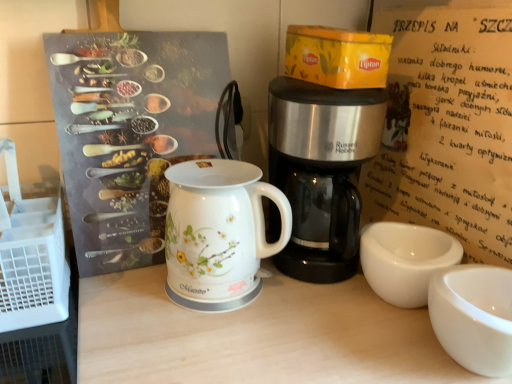
Question: Can you confirm if white glossy cup at lower right is smaller than stainless steel coffee maker at center?

Choices:
 (A) no
 (B) yes

Answer: (B)

Question: Is white glossy cup at lower right not near stainless steel coffee maker at center?

Choices:
 (A) yes
 (B) no

Answer: (B)

Question: Is white glossy cup at lower right positioned in front of stainless steel coffee maker at center?

Choices:
 (A) no
 (B) yes

Answer: (B)

Question: Is stainless steel coffee maker at center located within white glossy cup at lower right?

Choices:
 (A) no
 (B) yes

Answer: (A)

Question: Considering the relative sizes of white glossy cup at lower right and stainless steel coffee maker at center in the image provided, is white glossy cup at lower right wider than stainless steel coffee maker at center?

Choices:
 (A) no
 (B) yes

Answer: (A)

Question: Would you say stainless steel coffee maker at center is inside or outside white glossy cup at lower right?

Choices:
 (A) outside
 (B) inside

Answer: (A)

Question: Does point [x=306, y=130] appear closer or farther from the camera than point [x=473, y=314]?

Choices:
 (A) closer
 (B) farther

Answer: (B)

Question: Considering the positions of stainless steel coffee maker at center and white glossy cup at lower right in the image, is stainless steel coffee maker at center wider or thinner than white glossy cup at lower right?

Choices:
 (A) thin
 (B) wide

Answer: (B)

Question: From their relative heights in the image, would you say stainless steel coffee maker at center is taller or shorter than white glossy cup at lower right?

Choices:
 (A) tall
 (B) short

Answer: (A)

Question: In the image, is white glossy electric kettle at center positioned in front of or behind stainless steel coffee maker at center?

Choices:
 (A) behind
 (B) front

Answer: (A)

Question: From a real-world perspective, relative to stainless steel coffee maker at center, is white glossy electric kettle at center vertically above or below?

Choices:
 (A) above
 (B) below

Answer: (B)

Question: Is white glossy electric kettle at center wider or thinner than stainless steel coffee maker at center?

Choices:
 (A) thin
 (B) wide

Answer: (A)

Question: From the image's perspective, is white glossy electric kettle at center positioned above or below stainless steel coffee maker at center?

Choices:
 (A) below
 (B) above

Answer: (A)

Question: Is white glossy electric kettle at center in front of or behind white glossy cup at lower right in the image?

Choices:
 (A) behind
 (B) front

Answer: (A)

Question: Considering the positions of white glossy electric kettle at center and white glossy cup at lower right in the image, is white glossy electric kettle at center wider or thinner than white glossy cup at lower right?

Choices:
 (A) wide
 (B) thin

Answer: (A)